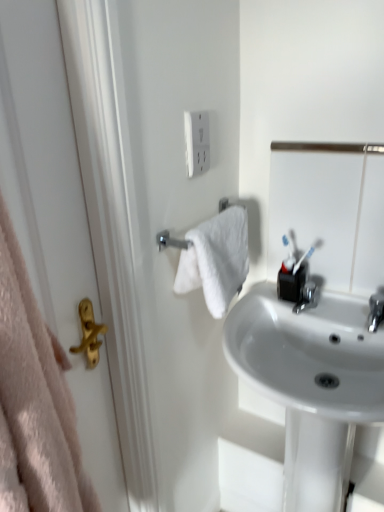
Question: Can you confirm if white glossy sink at center is taller than metallic silver mirror at upper right?

Choices:
 (A) no
 (B) yes

Answer: (B)

Question: From the image's perspective, is white glossy sink at center located above metallic silver mirror at upper right?

Choices:
 (A) yes
 (B) no

Answer: (B)

Question: Considering the relative sizes of white glossy sink at center and metallic silver mirror at upper right in the image provided, is white glossy sink at center bigger than metallic silver mirror at upper right?

Choices:
 (A) no
 (B) yes

Answer: (B)

Question: From the image's perspective, would you say white glossy sink at center is shown under metallic silver mirror at upper right?

Choices:
 (A) no
 (B) yes

Answer: (B)

Question: Is white glossy sink at center to the left of metallic silver mirror at upper right from the viewer's perspective?

Choices:
 (A) yes
 (B) no

Answer: (A)

Question: Can you confirm if white glossy sink at center is smaller than metallic silver mirror at upper right?

Choices:
 (A) yes
 (B) no

Answer: (B)

Question: Is silver metallic towel rack at center-left smaller than metallic silver mirror at upper right?

Choices:
 (A) yes
 (B) no

Answer: (A)

Question: Would you say metallic silver mirror at upper right is part of silver metallic towel rack at center-left's contents?

Choices:
 (A) yes
 (B) no

Answer: (B)

Question: Is silver metallic towel rack at center-left with metallic silver mirror at upper right?

Choices:
 (A) no
 (B) yes

Answer: (A)

Question: From a real-world perspective, is silver metallic towel rack at center-left located higher than metallic silver mirror at upper right?

Choices:
 (A) yes
 (B) no

Answer: (A)

Question: Is silver metallic towel rack at center-left far from metallic silver mirror at upper right?

Choices:
 (A) yes
 (B) no

Answer: (B)

Question: Is silver metallic towel rack at center-left taller than metallic silver mirror at upper right?

Choices:
 (A) no
 (B) yes

Answer: (A)

Question: From a real-world perspective, is matte gold handle at left under silver metallic towel rack at center-left?

Choices:
 (A) yes
 (B) no

Answer: (A)